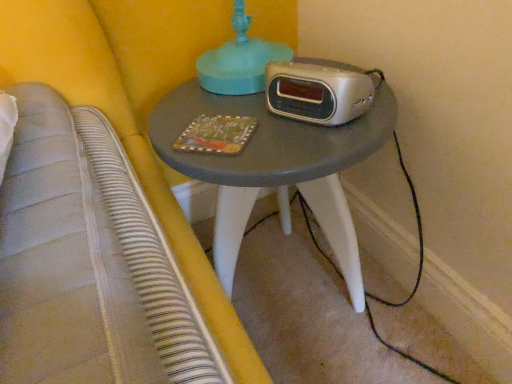
The image size is (512, 384). I want to click on unoccupied area in front of wooden painted book at center, so click(230, 158).